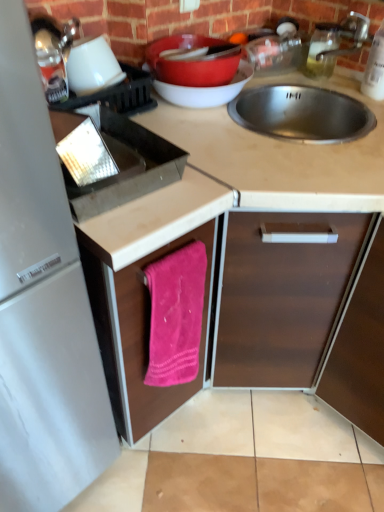
Question: Considering the relative positions of white matte cup at upper left, which ranks as the 1th appliance in right-to-left order, and metallic silver kettle at upper left, the 1th appliance from the left, in the image provided, is white matte cup at upper left, which ranks as the 1th appliance in right-to-left order, to the left or to the right of metallic silver kettle at upper left, the 1th appliance from the left,?

Choices:
 (A) right
 (B) left

Answer: (A)

Question: From a real-world perspective, is white matte cup at upper left, which ranks as the 1th appliance in right-to-left order, physically located above or below metallic silver kettle at upper left, the 1th appliance from the left?

Choices:
 (A) below
 (B) above

Answer: (A)

Question: Which object is the farthest from the smooth beige countertop at center?

Choices:
 (A) matte brown countertop at center
 (B) matte red bowl at upper center
 (C) metallic silver kettle at upper left, the 1th appliance from the left
 (D) silver metallic faucet at upper right
 (E) clear plastic bottle at upper right, the 1th bottle in the front-to-back sequence

Answer: (D)

Question: Which object is the farthest from the white matte cup at upper left, the second appliance viewed from the left?

Choices:
 (A) smooth beige countertop at center
 (B) matte brown countertop at center
 (C) brown matte cabinet at center, which appears as the second cabinetry when viewed from the left
 (D) clear plastic bottle at upper right, acting as the 2th bottle starting from the left
 (E) pink fabric towel at lower center, marked as the 1th cabinetry in a left-to-right arrangement

Answer: (C)